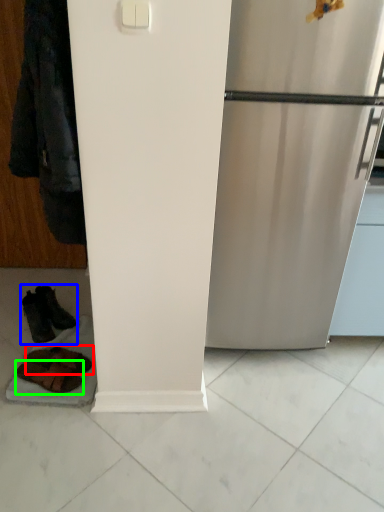
Question: Which is nearer to the footwear (highlighted by a red box)? footwear (highlighted by a blue box) or footwear (highlighted by a green box).

Choices:
 (A) footwear
 (B) footwear

Answer: (B)